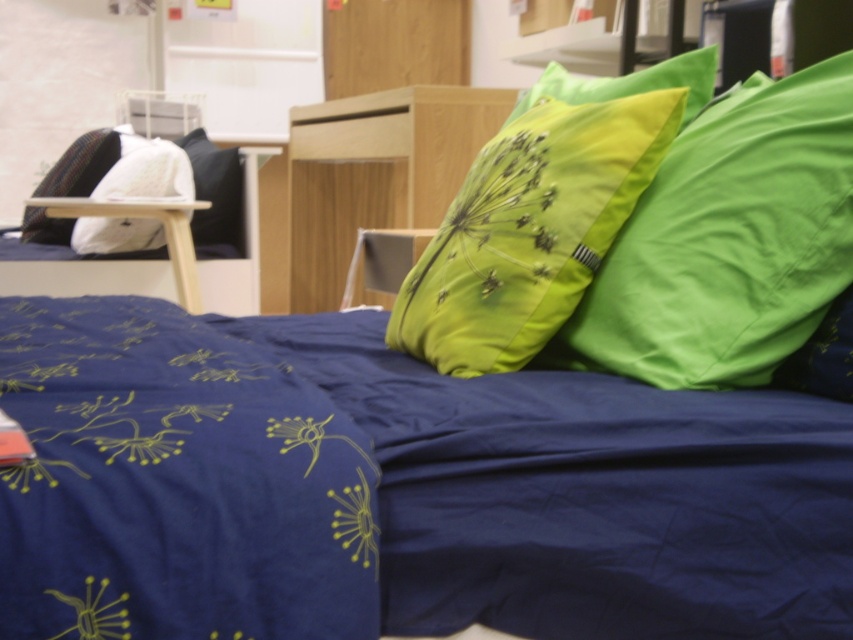
Can you confirm if navy blue satin blanket at lower left is wider than lime green quilted pillow at upper right?

Correct, the width of navy blue satin blanket at lower left exceeds that of lime green quilted pillow at upper right.

Can you confirm if navy blue satin blanket at lower left is bigger than lime green quilted pillow at upper right?

Yes, navy blue satin blanket at lower left is bigger than lime green quilted pillow at upper right.

At what (x,y) coordinates should I click in order to perform the action: click on navy blue satin blanket at lower left. Please return your answer as a coordinate pair (x, y). Looking at the image, I should click on (175, 483).

Consider the image. Is white soft pillow at upper left bigger than green fabric pillow at upper right?

Yes.

Is white soft pillow at upper left to the left of green fabric pillow at upper right from the viewer's perspective?

Yes, white soft pillow at upper left is to the left of green fabric pillow at upper right.

Describe the element at coordinates (146, 173) in the screenshot. I see `white soft pillow at upper left` at that location.

Where is `white soft pillow at upper left`? white soft pillow at upper left is located at coordinates (146, 173).

Is point (527, 118) less distant than point (682, 54)?

No, it is behind (682, 54).

Can you confirm if green fabric pillow at center is taller than green fabric pillow at upper right?

Yes.

Where is `green fabric pillow at center`? green fabric pillow at center is located at coordinates (529, 230).